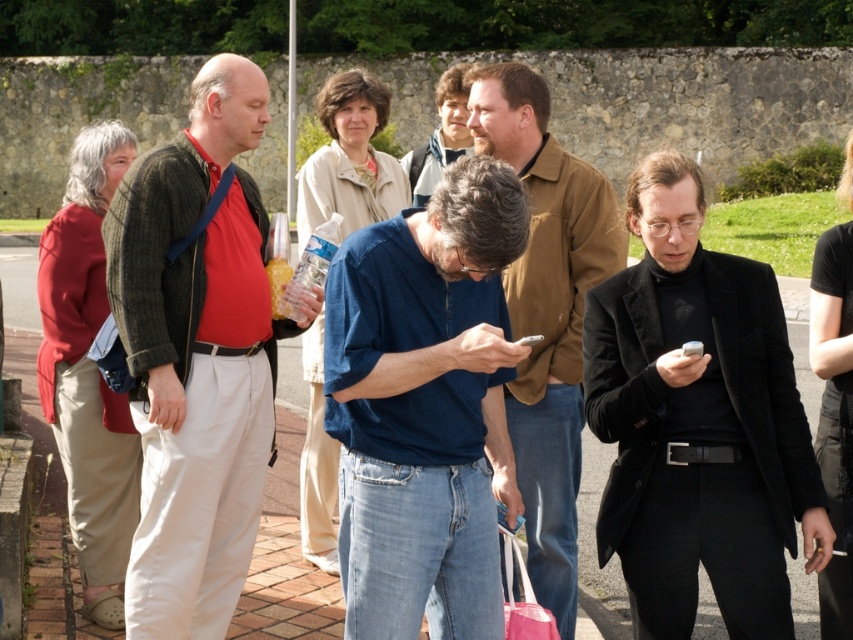
Question: Is matte brown jacket at center smaller than pink fabric shopping bag at lower center?

Choices:
 (A) no
 (B) yes

Answer: (A)

Question: From the image, what is the correct spatial relationship of black wool coat at center in relation to denim jeans at center?

Choices:
 (A) above
 (B) below

Answer: (B)

Question: Can you confirm if blue denim jeans at center is thinner than denim jeans at center?

Choices:
 (A) no
 (B) yes

Answer: (B)

Question: Considering the real-world distances, which object is closest to the denim jeans at center?

Choices:
 (A) blue denim jeans at center
 (B) matte brown jacket at center
 (C) matte red shirt at left

Answer: (A)

Question: Which of the following is the farthest from the observer?

Choices:
 (A) pink fabric shopping bag at lower center
 (B) blue denim jeans at center
 (C) black wool coat at center

Answer: (A)

Question: Estimate the real-world distances between objects in this image. Which object is farther from the matte red shirt at left?

Choices:
 (A) denim jeans at center
 (B) blue denim jeans at center
 (C) black wool coat at center

Answer: (C)